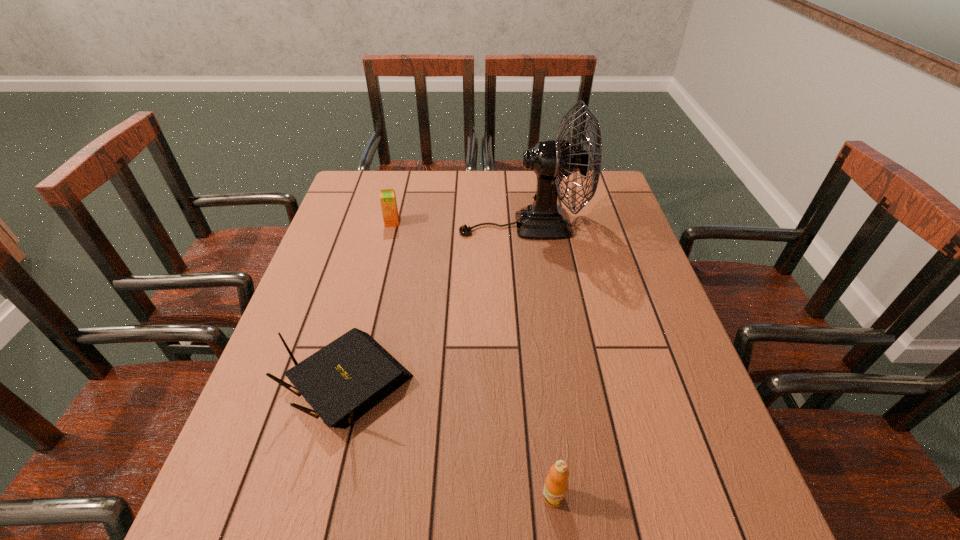
At what (x,y) coordinates should I click in order to perform the action: click on object that stands as the third closest to the fan. Please return your answer as a coordinate pair (x, y). Looking at the image, I should click on (556, 484).

At what (x,y) coordinates should I click in order to perform the action: click on free region that satisfies the following two spatial constraints: 1. in front of the fan, indicating the direction of air flow; 2. on the front label of the right orange juice. Please return your answer as a coordinate pair (x, y). Image resolution: width=960 pixels, height=540 pixels. Looking at the image, I should click on (556, 497).